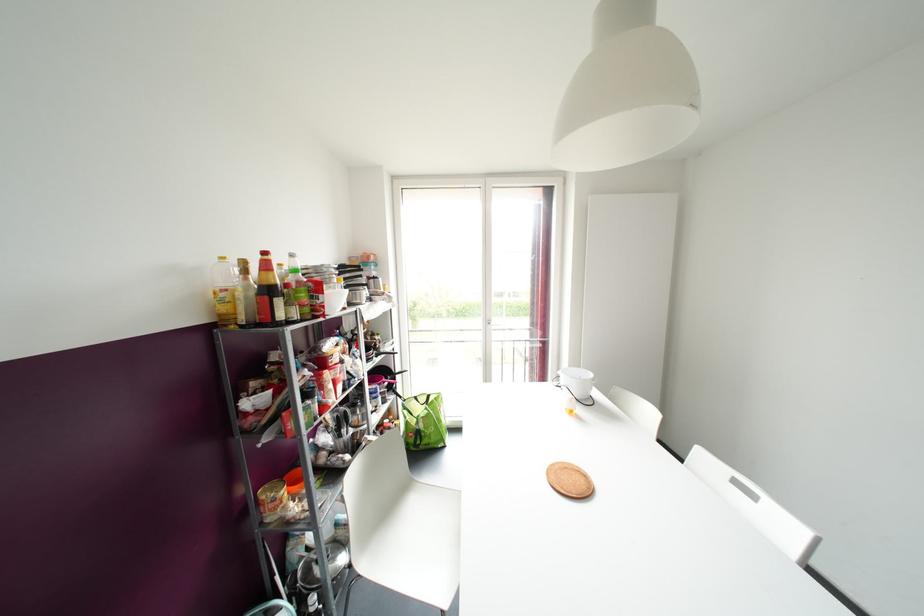
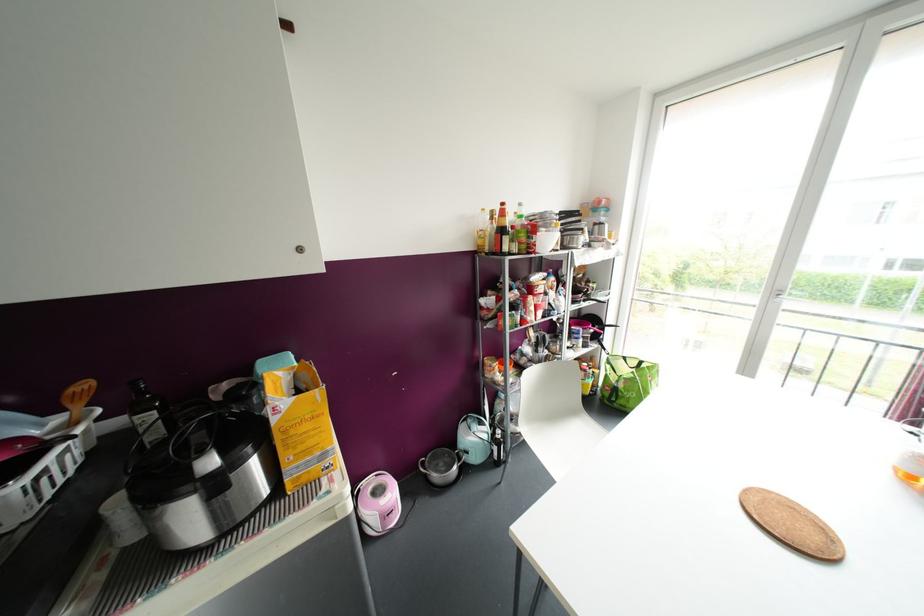
Find the pixel in the second image that matches (553,464) in the first image.

(769, 491)